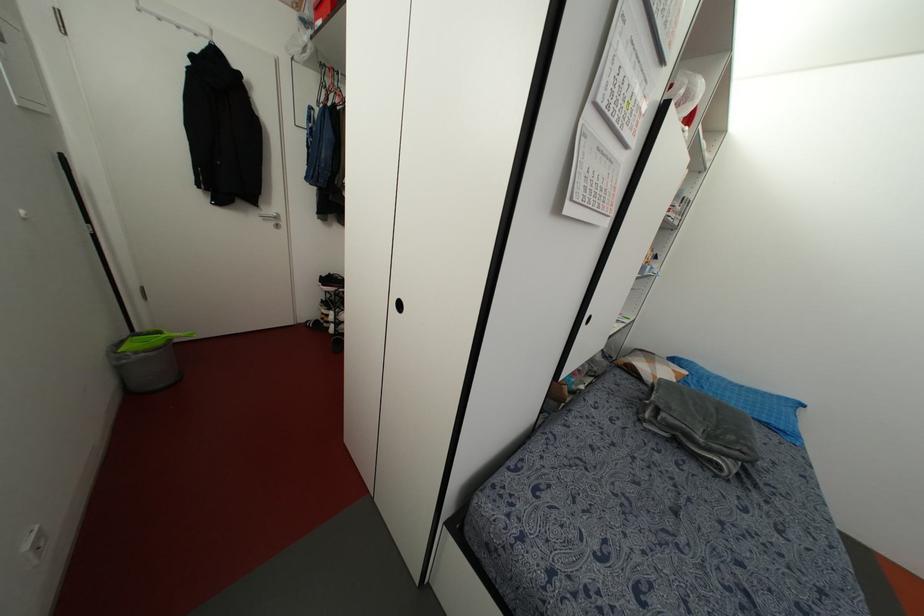
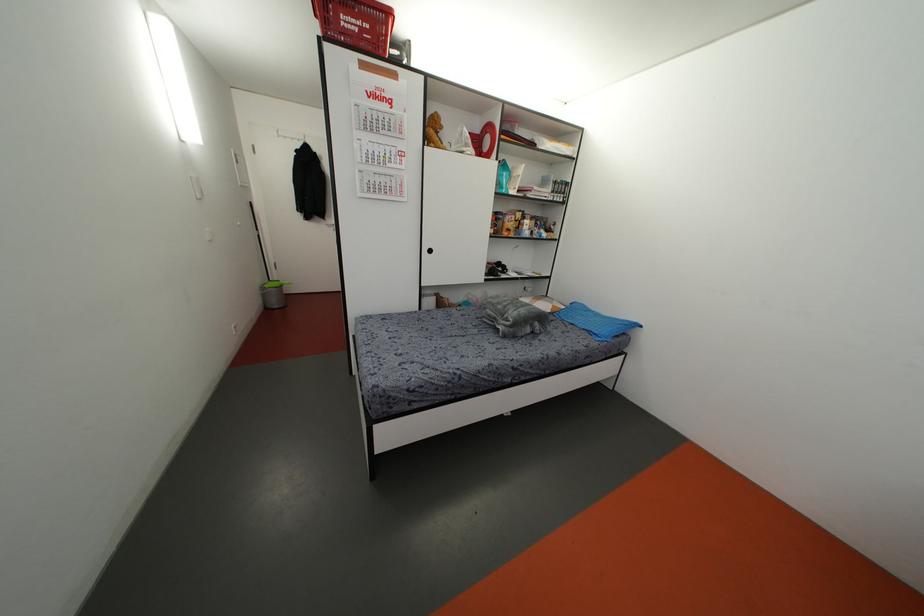
In the second image, find the point that corresponds to [782,427] in the first image.

(596, 331)